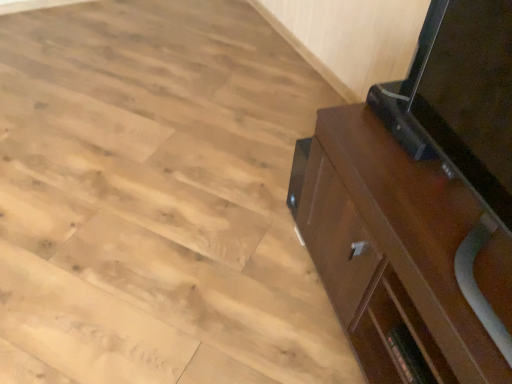
This screenshot has height=384, width=512. What do you see at coordinates (157, 200) in the screenshot?
I see `natural wood floor at lower right` at bounding box center [157, 200].

I want to click on natural wood floor at lower right, so click(157, 200).

What do you see at coordinates (401, 254) in the screenshot? I see `dark brown wood cabinet at right` at bounding box center [401, 254].

Find the location of a particular element. Image resolution: width=512 pixels, height=384 pixels. dark brown wood cabinet at right is located at coordinates (401, 254).

At what (x,y) coordinates should I click in order to perform the action: click on natural wood floor at lower right. Please return your answer as a coordinate pair (x, y). The width and height of the screenshot is (512, 384). Looking at the image, I should click on (157, 200).

Would you say natural wood floor at lower right is to the left or to the right of dark brown wood cabinet at right in the picture?

natural wood floor at lower right is positioned on dark brown wood cabinet at right's left side.

Is natural wood floor at lower right closer to camera compared to dark brown wood cabinet at right?

No.

Is point (60, 334) behind point (366, 211)?

Yes.

From the image's perspective, relative to dark brown wood cabinet at right, is natural wood floor at lower right above or below?

natural wood floor at lower right is above dark brown wood cabinet at right.

From a real-world perspective, is natural wood floor at lower right above or below dark brown wood cabinet at right?

In terms of real-world spatial position, natural wood floor at lower right is below dark brown wood cabinet at right.

Can you confirm if natural wood floor at lower right is thinner than dark brown wood cabinet at right?

No, natural wood floor at lower right is not thinner than dark brown wood cabinet at right.

Is natural wood floor at lower right taller than dark brown wood cabinet at right?

In fact, natural wood floor at lower right may be shorter than dark brown wood cabinet at right.

Based on their sizes in the image, would you say natural wood floor at lower right is bigger or smaller than dark brown wood cabinet at right?

In the image, natural wood floor at lower right appears to be larger than dark brown wood cabinet at right.

Can we say natural wood floor at lower right lies outside dark brown wood cabinet at right?

Yes, natural wood floor at lower right is outside of dark brown wood cabinet at right.

Is natural wood floor at lower right far away from dark brown wood cabinet at right?

They are positioned close to each other.

Could you tell me if natural wood floor at lower right is turned towards dark brown wood cabinet at right?

No, natural wood floor at lower right is not facing towards dark brown wood cabinet at right.

Consider the image. Can you tell me how much natural wood floor at lower right and dark brown wood cabinet at right differ in facing direction?

There is a 80.8-degree angle between the facing directions of natural wood floor at lower right and dark brown wood cabinet at right.

Find the location of `cabinetry lying on the right of natural wood floor at lower right`. cabinetry lying on the right of natural wood floor at lower right is located at coordinates (401, 254).

Does dark brown wood cabinet at right appear on the left side of natural wood floor at lower right?

No.

Which is behind, dark brown wood cabinet at right or natural wood floor at lower right?

natural wood floor at lower right is further away from the camera.

Considering the points (405, 383) and (86, 64), which point is behind, point (405, 383) or point (86, 64)?

Positioned behind is point (86, 64).

From the image's perspective, is dark brown wood cabinet at right beneath natural wood floor at lower right?

Indeed, from the image's perspective, dark brown wood cabinet at right is shown beneath natural wood floor at lower right.

From a real-world perspective, which is physically above, dark brown wood cabinet at right or natural wood floor at lower right?

dark brown wood cabinet at right is physically above.

Which object is thinner, dark brown wood cabinet at right or natural wood floor at lower right?

Thinner between the two is dark brown wood cabinet at right.

Considering the relative sizes of dark brown wood cabinet at right and natural wood floor at lower right in the image provided, is dark brown wood cabinet at right shorter than natural wood floor at lower right?

Incorrect, the height of dark brown wood cabinet at right does not fall short of that of natural wood floor at lower right.

Between dark brown wood cabinet at right and natural wood floor at lower right, which one has smaller size?

With smaller size is dark brown wood cabinet at right.

Is dark brown wood cabinet at right situated inside natural wood floor at lower right or outside?

The correct answer is: outside.

Is dark brown wood cabinet at right in contact with natural wood floor at lower right?

dark brown wood cabinet at right is not next to natural wood floor at lower right, and they're not touching.

Does dark brown wood cabinet at right turn towards natural wood floor at lower right?

No, dark brown wood cabinet at right is not turned towards natural wood floor at lower right.

How many degrees apart are the facing directions of dark brown wood cabinet at right and natural wood floor at lower right?

They differ by 80.8 degrees in their facing directions.

Locate an element on the screen. Image resolution: width=512 pixels, height=384 pixels. cabinetry below the natural wood floor at lower right (from the image's perspective) is located at coordinates (401, 254).

Find the location of a particular element. Image resolution: width=512 pixels, height=384 pixels. cabinetry that is in front of the natural wood floor at lower right is located at coordinates (401, 254).

At what (x,y) coordinates should I click in order to perform the action: click on plywood that appears behind the dark brown wood cabinet at right. Please return your answer as a coordinate pair (x, y). This screenshot has width=512, height=384. Looking at the image, I should click on (157, 200).